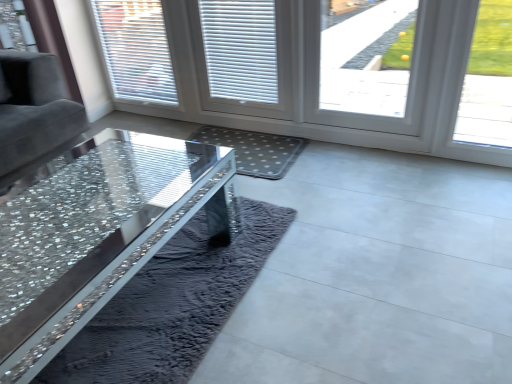
Question: Is white textured blinds at upper left, marked as the 1th window in a left-to-right arrangement, surrounding smooth concrete floor at center?

Choices:
 (A) no
 (B) yes

Answer: (A)

Question: From a real-world perspective, is white textured blinds at upper left, marked as the 1th window in a left-to-right arrangement, on top of smooth concrete floor at center?

Choices:
 (A) yes
 (B) no

Answer: (A)

Question: Is white textured blinds at upper left, positioned as the second window in right-to-left order, aimed at smooth concrete floor at center?

Choices:
 (A) no
 (B) yes

Answer: (A)

Question: Is white textured blinds at upper left, marked as the 1th window in a left-to-right arrangement, bigger than smooth concrete floor at center?

Choices:
 (A) no
 (B) yes

Answer: (A)

Question: Does white textured blinds at upper left, the first window from the back, come in front of smooth concrete floor at center?

Choices:
 (A) yes
 (B) no

Answer: (B)

Question: Is white plastic blinds at center taller or shorter than white plastic screen door at center?

Choices:
 (A) short
 (B) tall

Answer: (A)

Question: Visually, is white plastic blinds at center positioned to the left or to the right of white plastic screen door at center?

Choices:
 (A) left
 (B) right

Answer: (A)

Question: In the image, is white plastic blinds at center positioned in front of or behind white plastic screen door at center?

Choices:
 (A) behind
 (B) front

Answer: (A)

Question: In terms of width, does white plastic blinds at center look wider or thinner when compared to white plastic screen door at center?

Choices:
 (A) wide
 (B) thin

Answer: (B)

Question: From their relative heights in the image, would you say white plastic blinds at center is taller or shorter than crystal glass table at center?

Choices:
 (A) tall
 (B) short

Answer: (A)

Question: Is white plastic blinds at center situated inside crystal glass table at center or outside?

Choices:
 (A) inside
 (B) outside

Answer: (B)

Question: From a real-world perspective, is white plastic blinds at center above or below crystal glass table at center?

Choices:
 (A) below
 (B) above

Answer: (B)

Question: Relative to crystal glass table at center, is white plastic blinds at center in front or behind?

Choices:
 (A) behind
 (B) front

Answer: (A)

Question: From a real-world perspective, relative to smooth concrete floor at center, is transparent glass window at upper right, which is the first window from right to left, vertically above or below?

Choices:
 (A) below
 (B) above

Answer: (B)

Question: Considering the positions of point (359, 69) and point (459, 233), is point (359, 69) closer or farther from the camera than point (459, 233)?

Choices:
 (A) closer
 (B) farther

Answer: (B)